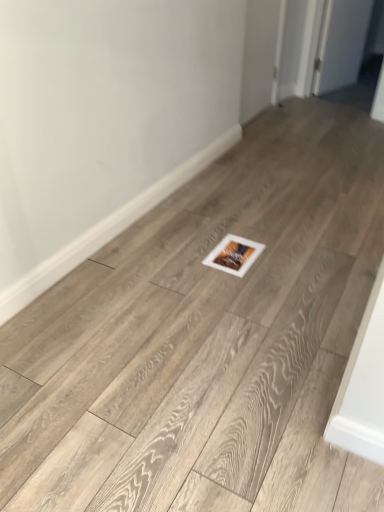
Locate an element on the screen. vacant space behind white matte picture frame at center is located at coordinates point(227,224).